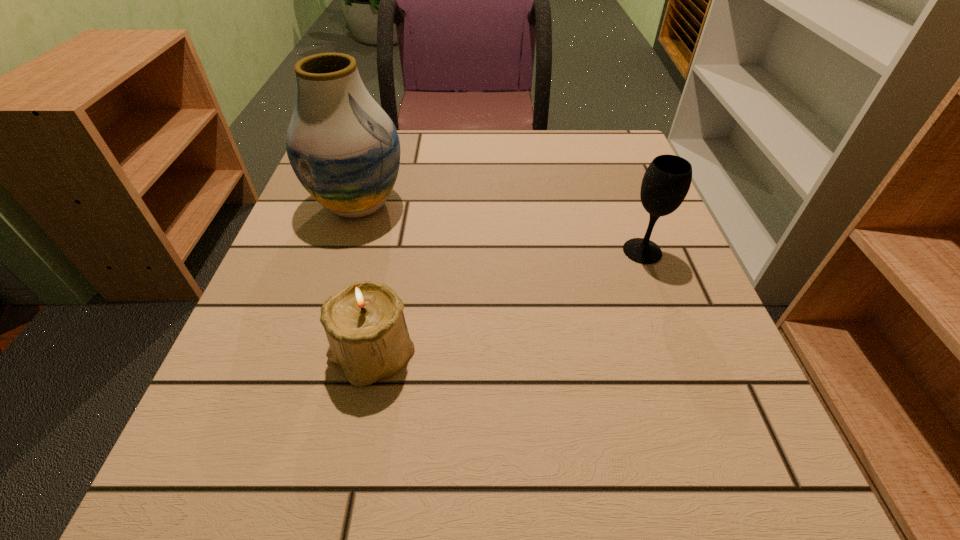
Identify the location of free space in the image that satisfies the following two spatial constraints: 1. on the back side of the nearest object; 2. on the right side of the wineglass. (393, 251).